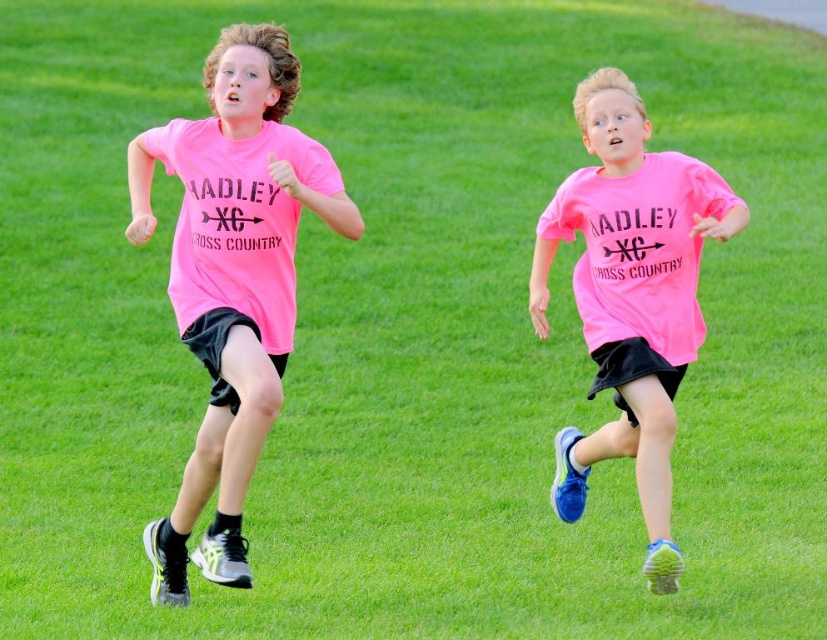
Question: Does pink matte shirt at left appear under pink matte shirt at center?

Choices:
 (A) yes
 (B) no

Answer: (B)

Question: Is pink matte shirt at left wider than pink matte shirt at center?

Choices:
 (A) no
 (B) yes

Answer: (B)

Question: Which point appears farthest from the camera in this image?

Choices:
 (A) (220, 48)
 (B) (614, 154)

Answer: (B)

Question: Is pink matte shirt at left bigger than pink matte shirt at center?

Choices:
 (A) no
 (B) yes

Answer: (B)

Question: Which point is closer to the camera?

Choices:
 (A) (228, 445)
 (B) (594, 168)

Answer: (A)